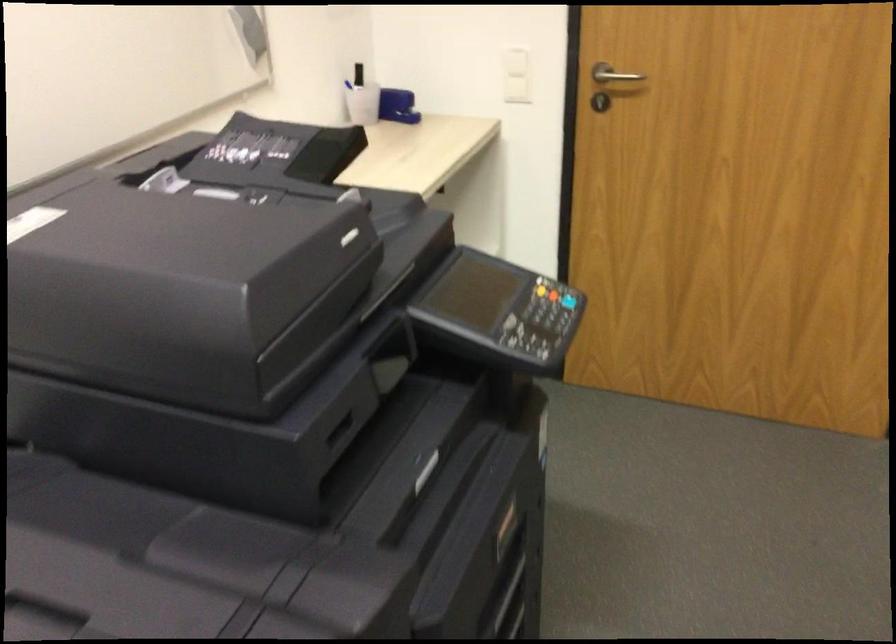
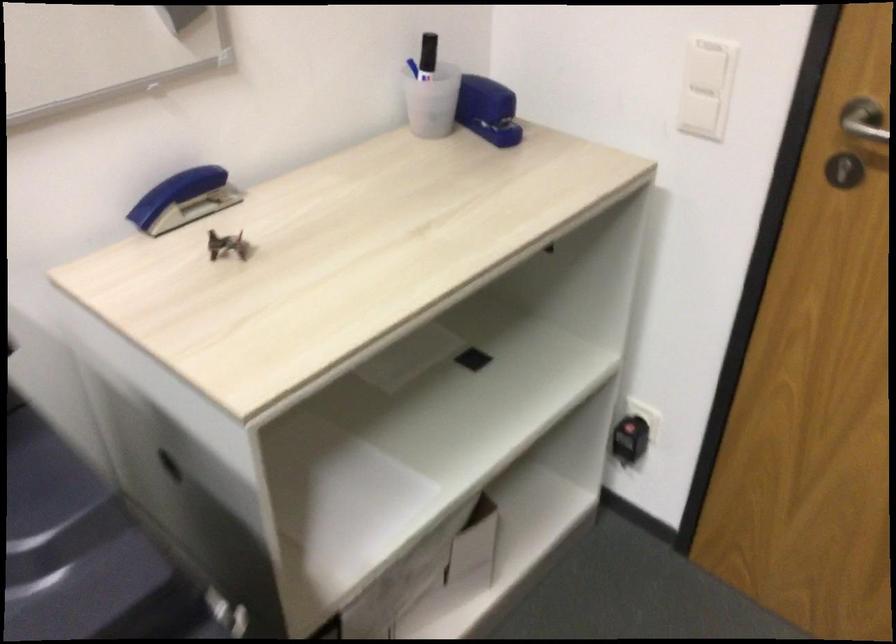
Where in the second image is the point corresponding to pixel 613 75 from the first image?

(864, 120)